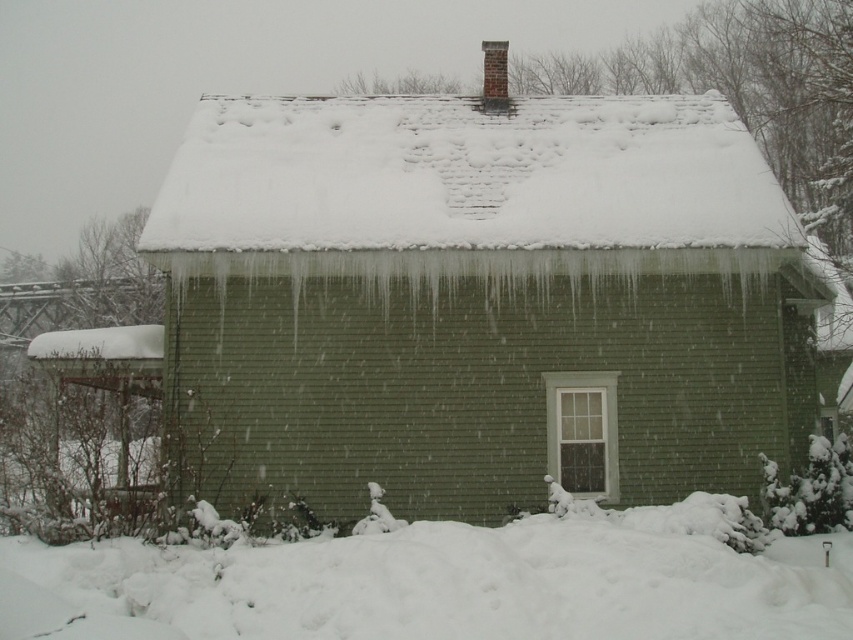
Consider the image. Does white shingles at upper center have a greater height compared to white fluffy snow at lower center?

Yes, white shingles at upper center is taller than white fluffy snow at lower center.

Is point (389, 244) farther from camera compared to point (402, 536)?

Yes, it is behind point (402, 536).

Find the location of a particular element. This screenshot has height=640, width=853. white shingles at upper center is located at coordinates (467, 176).